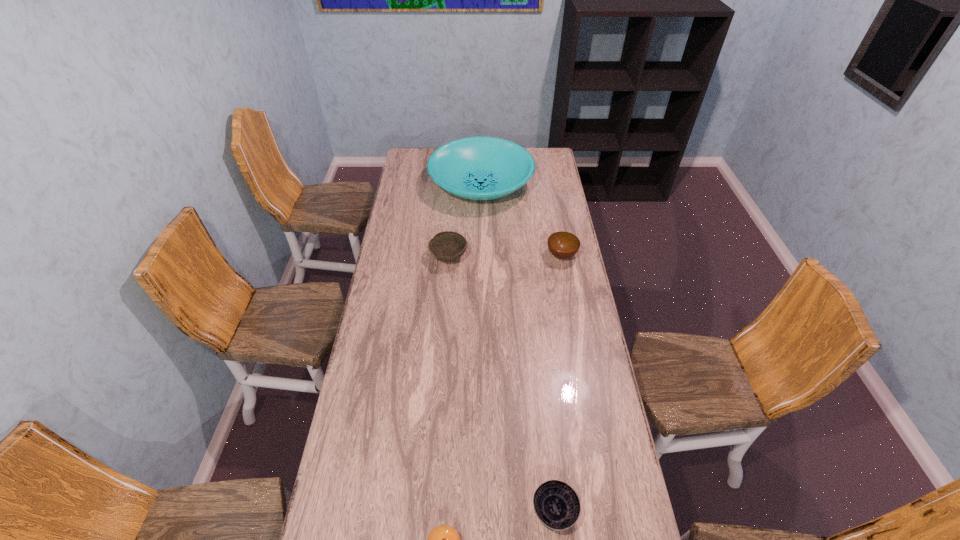
Find the location of `vacant space that's between the tallest object and the shortest object`. vacant space that's between the tallest object and the shortest object is located at coordinates (517, 348).

The image size is (960, 540). Find the location of `vacant space that's between the rightmost bowl and the tallest object`. vacant space that's between the rightmost bowl and the tallest object is located at coordinates (521, 220).

At what (x,y) coordinates should I click in order to perform the action: click on vacant space that is in between the nearest bowl and the leftmost bowl. Please return your answer as a coordinate pair (x, y). This screenshot has width=960, height=540. Looking at the image, I should click on (501, 384).

Find the location of a particular element. The image size is (960, 540). free area in between the leftmost bowl and the farthest object is located at coordinates (x=465, y=221).

The width and height of the screenshot is (960, 540). I want to click on free space that is in between the rightmost object and the shortest bowl, so click(558, 383).

You are a GUI agent. You are given a task and a screenshot of the screen. Output one action in this format:
    pyautogui.click(x=<x>, y=<y>)
    Task: Click on the closest object to the tallest object
    
    Given the screenshot: What is the action you would take?
    pyautogui.click(x=447, y=246)

Find the location of `object that can be found as the fourth closest to the shortest bowl`. object that can be found as the fourth closest to the shortest bowl is located at coordinates (478, 168).

Locate which bowl is the third closest to the dish. Please provide its 2D coordinates. Your answer should be formatted as a tuple, i.e. [(x, y)], where the tuple contains the x and y coordinates of a point satisfying the conditions above.

[(556, 504)]

Where is `bowl that can be found as the third closest to the farthest object`? The height and width of the screenshot is (540, 960). bowl that can be found as the third closest to the farthest object is located at coordinates (556, 504).

Where is `blank space that satisfies the following two spatial constraints: 1. on the back side of the farthest object; 2. on the left side of the leftmost bowl`? The width and height of the screenshot is (960, 540). blank space that satisfies the following two spatial constraints: 1. on the back side of the farthest object; 2. on the left side of the leftmost bowl is located at coordinates (454, 184).